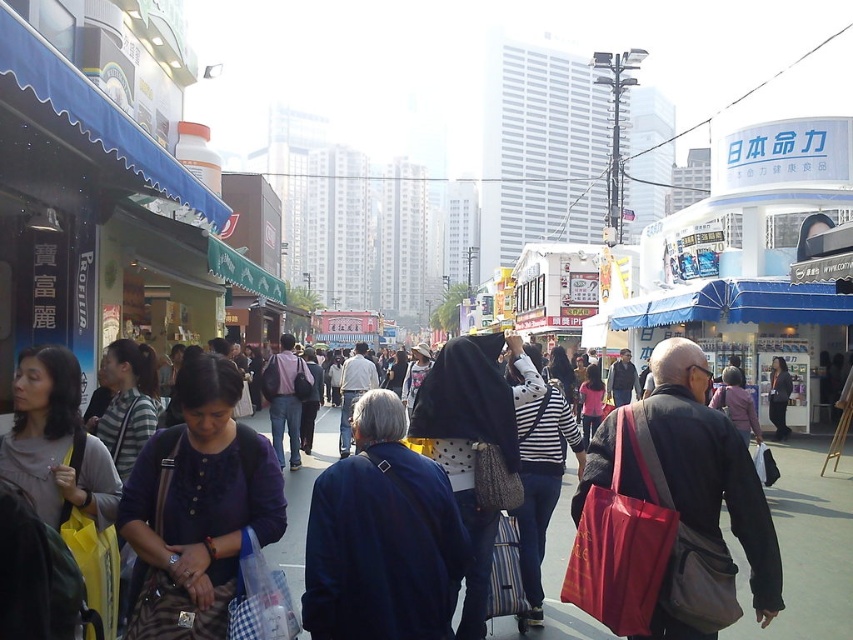
Question: Does red fabric bag at center come in front of dark gray sweater at center?

Choices:
 (A) no
 (B) yes

Answer: (B)

Question: Is matte black jacket at center closer to the viewer compared to red fabric bag at center?

Choices:
 (A) yes
 (B) no

Answer: (A)

Question: Which point is closer to the camera?

Choices:
 (A) (775, 384)
 (B) (318, 609)

Answer: (B)

Question: Which point appears farthest from the camera in this image?

Choices:
 (A) (740, 508)
 (B) (775, 429)
 (C) (398, 449)
 (D) (683, 419)

Answer: (B)

Question: Estimate the real-world distances between objects in this image. Which object is closer to the matte blue shirt at center?

Choices:
 (A) red fabric bag at center
 (B) dark gray sweater at center
 (C) dark blue jacket at center

Answer: (C)

Question: Is matte black jacket at center wider than dark blue jacket at center?

Choices:
 (A) yes
 (B) no

Answer: (A)